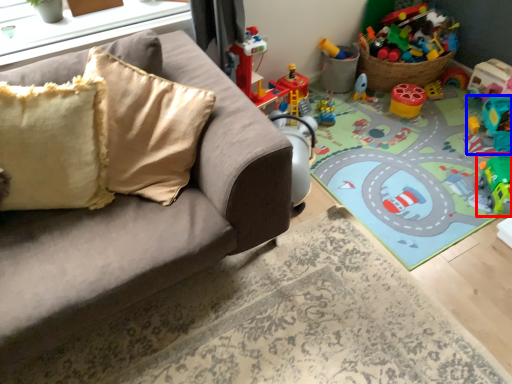
Question: Which object appears farthest to the camera in this image, toy (highlighted by a red box) or toy (highlighted by a blue box)?

Choices:
 (A) toy
 (B) toy

Answer: (B)